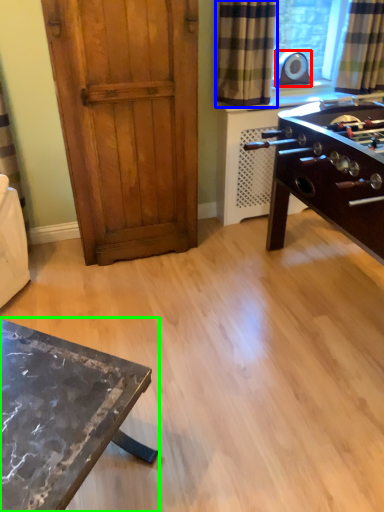
Question: Which object is positioned closest to appliance (highlighted by a red box)? Select from curtain (highlighted by a blue box) and table (highlighted by a green box).

Choices:
 (A) curtain
 (B) table

Answer: (A)